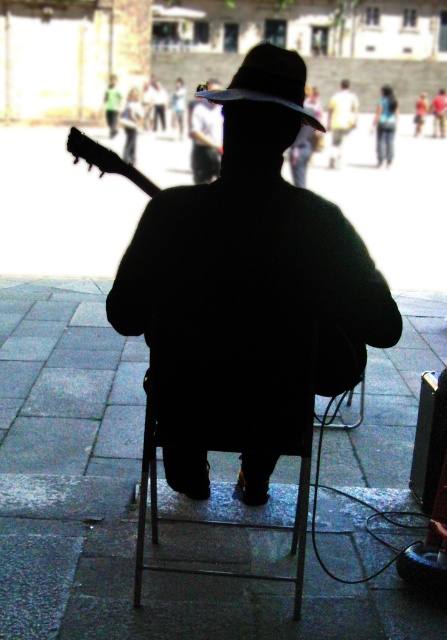
Which is above, gray concrete pavement at center or black matte guitar at center?

Positioned higher is black matte guitar at center.

Does gray concrete pavement at center appear over black matte guitar at center?

Actually, gray concrete pavement at center is below black matte guitar at center.

Does point (237, 584) come behind point (383, 317)?

Yes, it is.

At what (x,y) coordinates should I click in order to perform the action: click on gray concrete pavement at center. Please return your answer as a coordinate pair (x, y). Looking at the image, I should click on (123, 500).

Which is more to the left, black felt fedora at center or matte black guitar at center?

From the viewer's perspective, matte black guitar at center appears more on the left side.

At what (x,y) coordinates should I click in order to perform the action: click on black felt fedora at center. Please return your answer as a coordinate pair (x, y). The width and height of the screenshot is (447, 640). Looking at the image, I should click on (268, 81).

Does gray concrete pavement at center lie in front of black felt fedora at center?

No, it is not.

Does gray concrete pavement at center have a smaller size compared to black felt fedora at center?

Incorrect, gray concrete pavement at center is not smaller in size than black felt fedora at center.

Is point (102, 534) less distant than point (249, 67)?

No, (102, 534) is behind (249, 67).

This screenshot has width=447, height=640. In order to click on gray concrete pavement at center in this screenshot , I will do `click(123, 500)`.